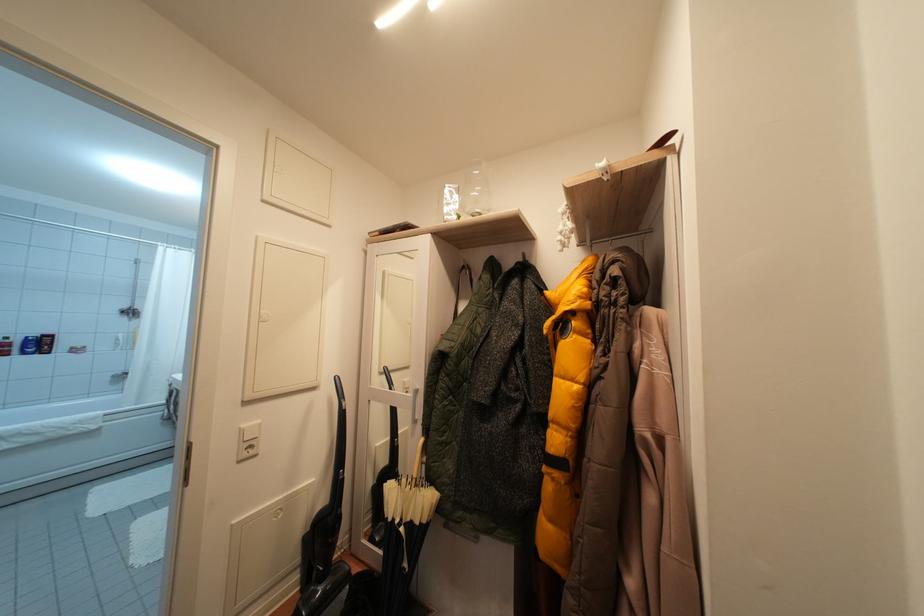
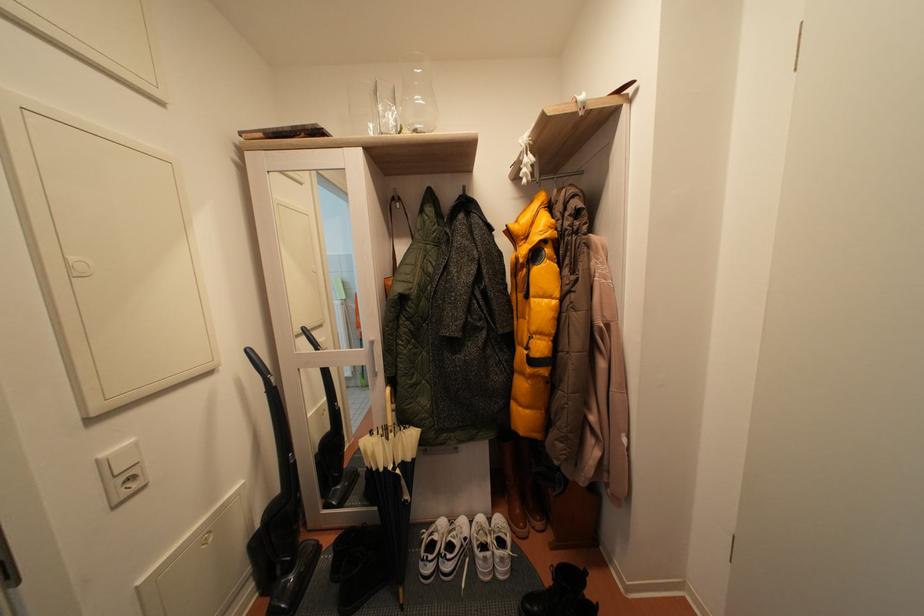
Find the pixel in the second image that matches pixel 417 485 in the first image.

(387, 437)